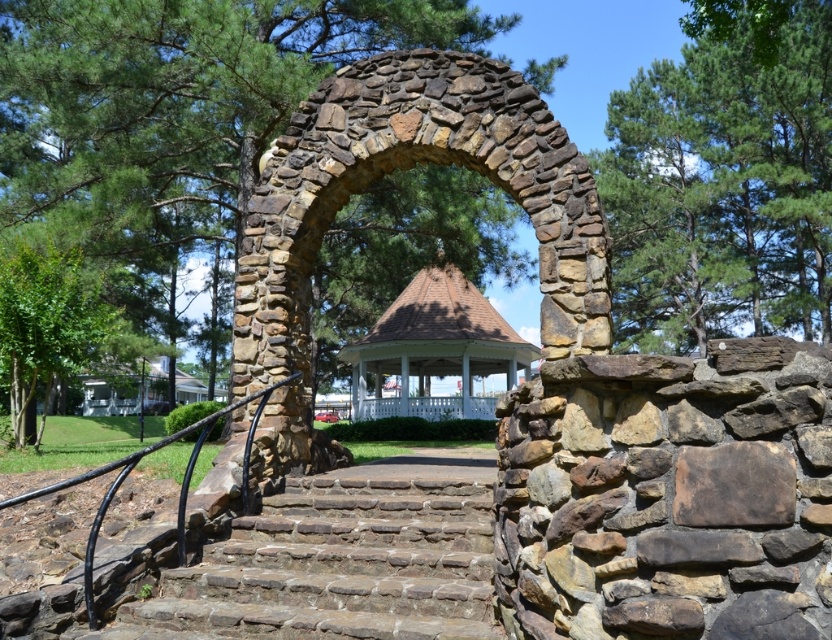
Can you confirm if white wooden gazebo at center is wider than green leafy tree at left?

Yes, white wooden gazebo at center is wider than green leafy tree at left.

Locate an element on the screen. white wooden gazebo at center is located at coordinates (434, 349).

At what (x,y) coordinates should I click in order to perform the action: click on white wooden gazebo at center. Please return your answer as a coordinate pair (x, y). This screenshot has width=832, height=640. Looking at the image, I should click on (434, 349).

Locate an element on the screen. The image size is (832, 640). green leafy tree at upper right is located at coordinates (722, 189).

Which is below, green leafy tree at upper right or brown stone arch at center?

brown stone arch at center is lower down.

Image resolution: width=832 pixels, height=640 pixels. Describe the element at coordinates (722, 189) in the screenshot. I see `green leafy tree at upper right` at that location.

What are the coordinates of `green leafy tree at upper right` in the screenshot? It's located at (722, 189).

Between green leafy tree at center and brown stone stairs at center, which one is positioned lower?

brown stone stairs at center

Does green leafy tree at center come behind brown stone stairs at center?

Yes, it is.

You are a GUI agent. You are given a task and a screenshot of the screen. Output one action in this format:
    pyautogui.click(x=<x>, y=<y>)
    Task: Click on the green leafy tree at center
    The width and height of the screenshot is (832, 640).
    Given the screenshot: What is the action you would take?
    pyautogui.click(x=176, y=104)